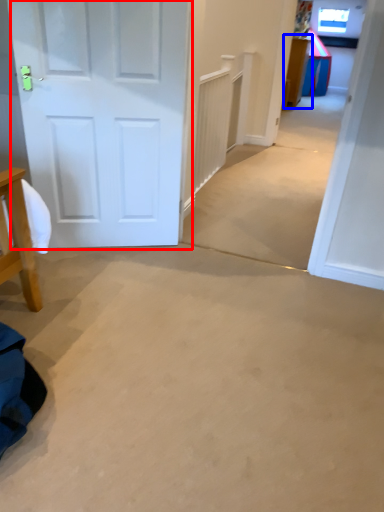
Question: Which object appears closest to the camera in this image, door (highlighted by a red box) or table (highlighted by a blue box)?

Choices:
 (A) door
 (B) table

Answer: (A)